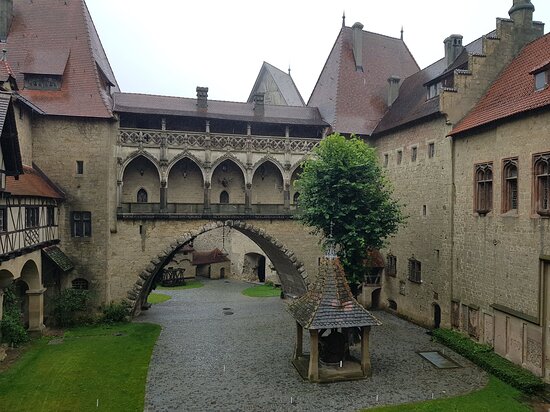
Where is `tv`? The height and width of the screenshot is (412, 550). tv is located at coordinates (541, 81).